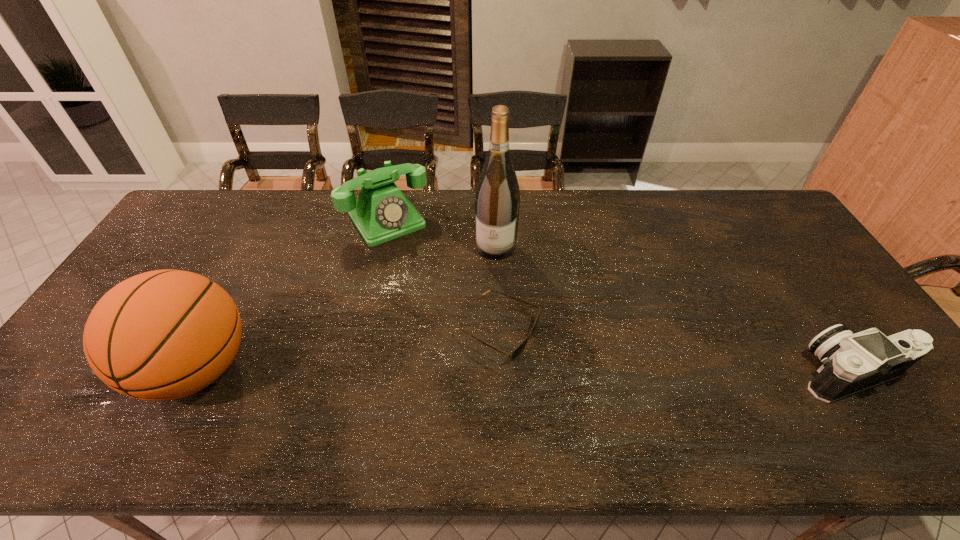
The width and height of the screenshot is (960, 540). What are the coordinates of `basketball located in the near edge section of the desktop` in the screenshot? It's located at (166, 334).

The image size is (960, 540). I want to click on camera at the near edge, so click(x=851, y=362).

In order to click on object situated at the right edge in this screenshot , I will do click(x=851, y=362).

You are a GUI agent. You are given a task and a screenshot of the screen. Output one action in this format:
    pyautogui.click(x=<x>, y=<y>)
    Task: Click on the object that is positioned at the near right corner
    
    Given the screenshot: What is the action you would take?
    pyautogui.click(x=851, y=362)

In the image, there is a desktop. Identify the location of free space at the far edge. This screenshot has width=960, height=540. (614, 195).

The height and width of the screenshot is (540, 960). In the image, there is a desktop. Find the location of `vacant space at the near edge`. vacant space at the near edge is located at coordinates (271, 382).

I want to click on vacant space at the left edge of the desktop, so click(x=154, y=268).

At what (x,y) coordinates should I click in order to perform the action: click on vacant space at the right edge of the desktop. Please return your answer as a coordinate pair (x, y). This screenshot has width=960, height=540. Looking at the image, I should click on 796,284.

In the image, there is a desktop. Find the location of `vacant space at the far left corner`. vacant space at the far left corner is located at coordinates (187, 229).

Locate an element on the screen. free space at the far right corner of the desktop is located at coordinates (748, 195).